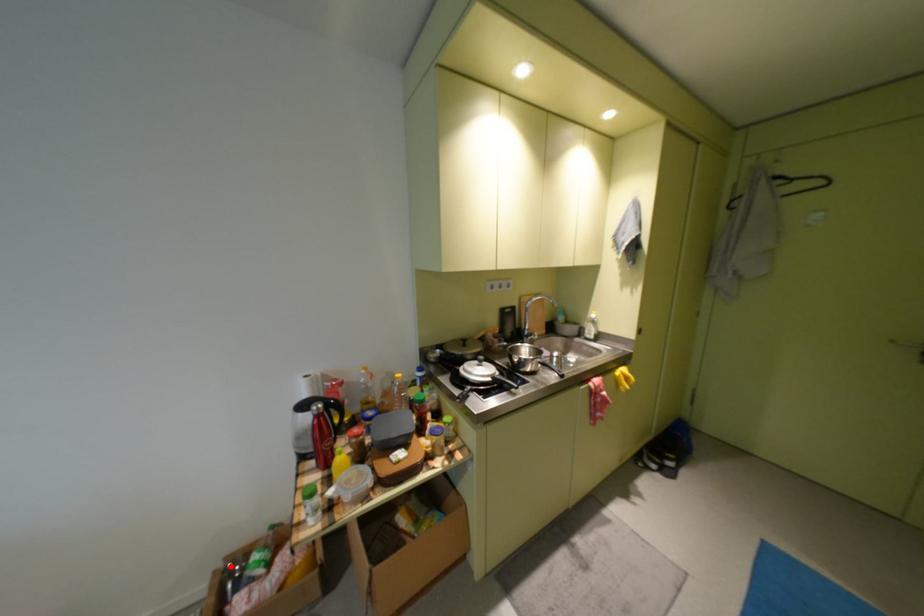
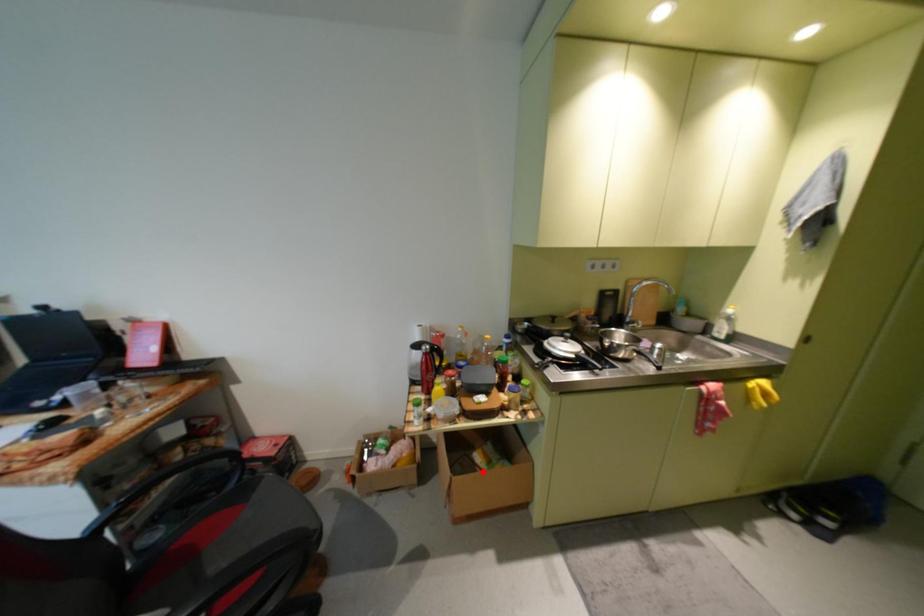
I am providing you with two images of the same scene from different viewpoints. A red point is marked on the first image and another point is marked on the second image. Is the red point in image1 aligned with the point shown in image2?

No